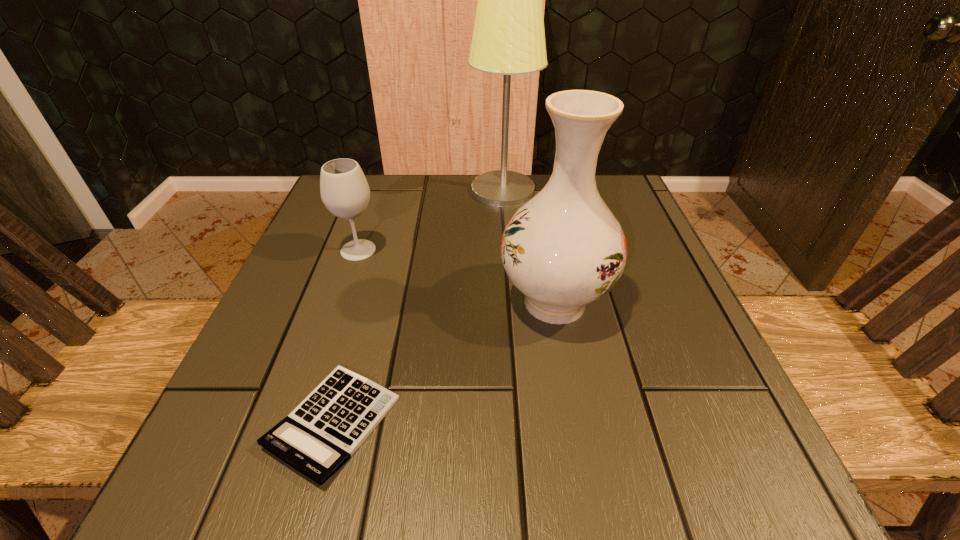
Identify the location of free space located 0.320m on the right of the second farthest object. The image size is (960, 540). (537, 251).

Find the location of a particular element. The width and height of the screenshot is (960, 540). free space located on the back of the shortest object is located at coordinates (359, 329).

Locate an element on the screen. This screenshot has width=960, height=540. object positioned at the far edge is located at coordinates (508, 38).

The width and height of the screenshot is (960, 540). In order to click on object present at the near edge in this screenshot , I will do `click(320, 435)`.

This screenshot has height=540, width=960. Find the location of `wineglass that is at the left edge`. wineglass that is at the left edge is located at coordinates (345, 192).

At what (x,y) coordinates should I click in order to perform the action: click on calculator situated at the left edge. Please return your answer as a coordinate pair (x, y). The height and width of the screenshot is (540, 960). Looking at the image, I should click on (320, 435).

Locate an element on the screen. Image resolution: width=960 pixels, height=540 pixels. object that is positioned at the right edge is located at coordinates (563, 249).

I want to click on object positioned at the near left corner, so click(320, 435).

Image resolution: width=960 pixels, height=540 pixels. In the image, there is a desktop. Identify the location of free space at the far edge. (407, 214).

Where is `vacant space at the left edge of the desktop`? This screenshot has width=960, height=540. vacant space at the left edge of the desktop is located at coordinates (293, 262).